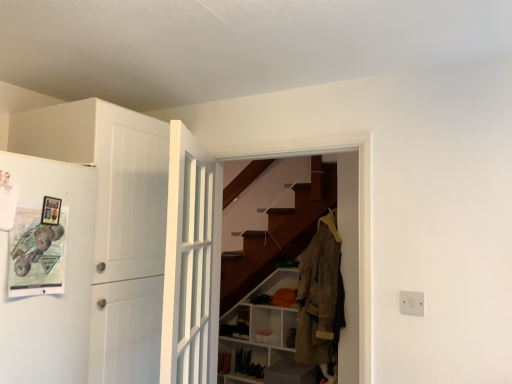
Question: From a real-world perspective, is white plastic switch at lower right located higher than white matte cabinet at lower center?

Choices:
 (A) yes
 (B) no

Answer: (A)

Question: Does white plastic switch at lower right appear on the left side of white matte cabinet at lower center?

Choices:
 (A) no
 (B) yes

Answer: (A)

Question: From the image's perspective, is white plastic switch at lower right located beneath white matte cabinet at lower center?

Choices:
 (A) yes
 (B) no

Answer: (B)

Question: Considering the relative positions of white plastic switch at lower right and white matte cabinet at lower center in the image provided, is white plastic switch at lower right to the right of white matte cabinet at lower center from the viewer's perspective?

Choices:
 (A) no
 (B) yes

Answer: (B)

Question: Can you confirm if white plastic switch at lower right is thinner than white matte cabinet at lower center?

Choices:
 (A) no
 (B) yes

Answer: (B)

Question: Is white plastic switch at lower right positioned before white matte cabinet at lower center?

Choices:
 (A) no
 (B) yes

Answer: (B)

Question: Is white glossy door at center, marked as the 1th door in a right-to-left arrangement, positioned far away from white matte cabinet at lower center?

Choices:
 (A) yes
 (B) no

Answer: (A)

Question: Is white glossy door at center, marked as the 1th door in a right-to-left arrangement, positioned in front of white matte cabinet at lower center?

Choices:
 (A) yes
 (B) no

Answer: (A)

Question: Is white glossy door at center, marked as the 1th door in a right-to-left arrangement, oriented away from white matte cabinet at lower center?

Choices:
 (A) yes
 (B) no

Answer: (B)

Question: Considering the relative sizes of white glossy door at center, marked as the 1th door in a right-to-left arrangement, and white matte cabinet at lower center in the image provided, is white glossy door at center, marked as the 1th door in a right-to-left arrangement, bigger than white matte cabinet at lower center?

Choices:
 (A) no
 (B) yes

Answer: (A)

Question: Can you confirm if white glossy door at center, marked as the 1th door in a right-to-left arrangement, is thinner than white matte cabinet at lower center?

Choices:
 (A) yes
 (B) no

Answer: (A)

Question: Does white glossy door at center, the 2th door from the left, have a lesser height compared to white matte cabinet at lower center?

Choices:
 (A) no
 (B) yes

Answer: (B)

Question: From the image's perspective, is white plastic switch at lower right on white matte door at left, which is counted as the 1th door, starting from the left?

Choices:
 (A) no
 (B) yes

Answer: (A)